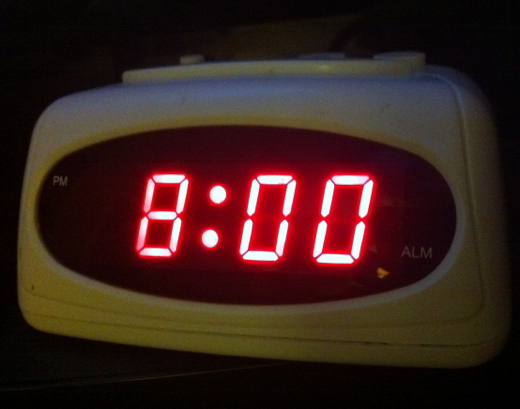
The height and width of the screenshot is (409, 520). I want to click on lights, so click(x=174, y=236), click(x=212, y=243), click(x=218, y=196), click(x=255, y=199), click(x=329, y=198).